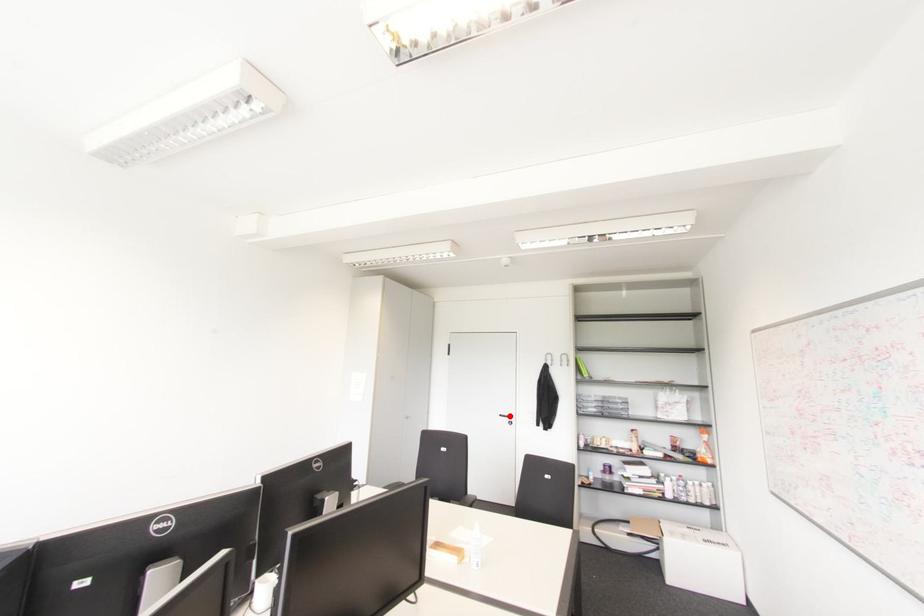
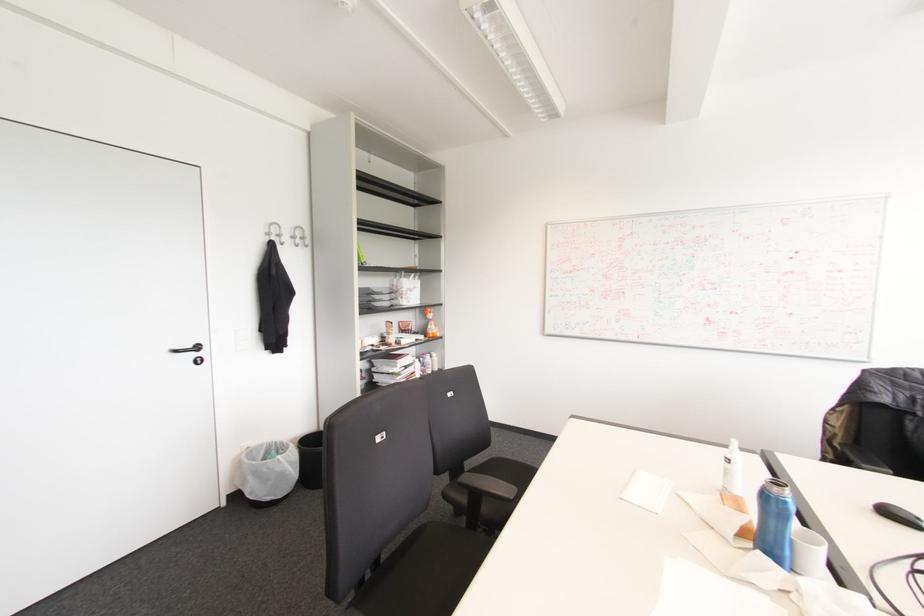
The point at the highlighted location is marked in the first image. Where is the corresponding point in the second image?

(197, 347)